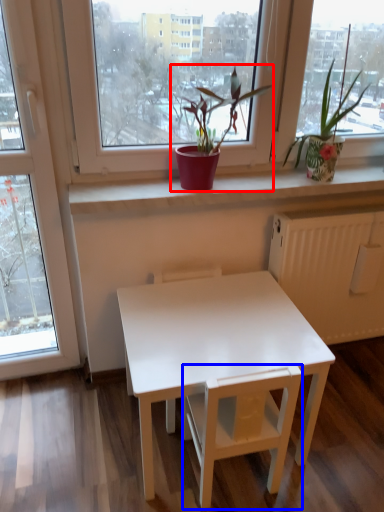
Question: Which of the following is the farthest to the observer, houseplant (highlighted by a red box) or armchair (highlighted by a blue box)?

Choices:
 (A) houseplant
 (B) armchair

Answer: (A)